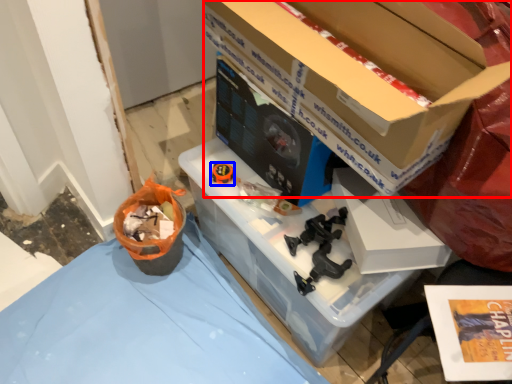
Question: Which of the following is the farthest to the observer, box (highlighted by a red box) or toy (highlighted by a blue box)?

Choices:
 (A) box
 (B) toy

Answer: (B)